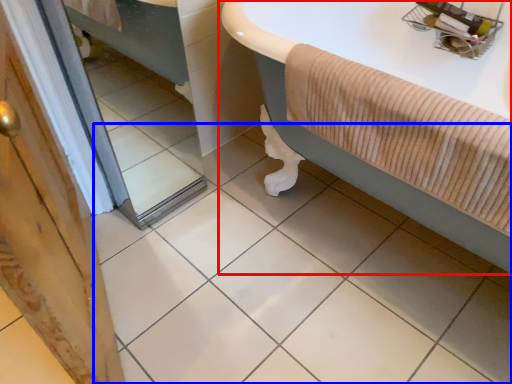
Question: Which of the following is the closest to the observer, bathtub (highlighted by a red box) or ceramic tile (highlighted by a blue box)?

Choices:
 (A) bathtub
 (B) ceramic tile

Answer: (B)